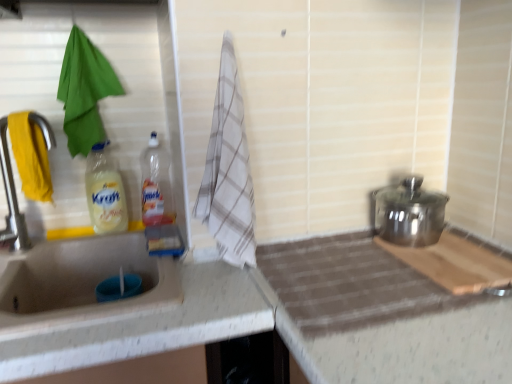
Question: Should I look upward or downward to see translucent plastic bottle at center, placed as the second bottle when sorted from left to right?

Choices:
 (A) up
 (B) down

Answer: (A)

Question: Are translucent plastic bottle at center, placed as the second bottle when sorted from left to right, and polished stainless steel pot at right beside each other?

Choices:
 (A) yes
 (B) no

Answer: (B)

Question: Does translucent plastic bottle at center, positioned as the 1th bottle in right-to-left order, turn towards polished stainless steel pot at right?

Choices:
 (A) no
 (B) yes

Answer: (A)

Question: Does translucent plastic bottle at center, positioned as the 1th bottle in right-to-left order, have a lesser width compared to polished stainless steel pot at right?

Choices:
 (A) yes
 (B) no

Answer: (A)

Question: Considering the relative sizes of translucent plastic bottle at center, positioned as the 1th bottle in right-to-left order, and polished stainless steel pot at right in the image provided, is translucent plastic bottle at center, positioned as the 1th bottle in right-to-left order, wider than polished stainless steel pot at right?

Choices:
 (A) yes
 (B) no

Answer: (B)

Question: Is translucent plastic bottle at center, positioned as the 1th bottle in right-to-left order, further to camera compared to polished stainless steel pot at right?

Choices:
 (A) yes
 (B) no

Answer: (A)

Question: Is the position of translucent plastic bottle at center, placed as the second bottle when sorted from left to right, less distant than that of polished stainless steel pot at right?

Choices:
 (A) yes
 (B) no

Answer: (B)

Question: From a real-world perspective, is translucent plastic bottle at center, positioned as the 1th bottle in right-to-left order, physically below white checkered towel at center, the 1th beach towel in the front-to-back sequence?

Choices:
 (A) no
 (B) yes

Answer: (B)

Question: Is translucent plastic bottle at center, positioned as the 1th bottle in right-to-left order, facing towards white checkered towel at center, the 2th beach towel from the back?

Choices:
 (A) yes
 (B) no

Answer: (B)

Question: Is the surface of translucent plastic bottle at center, placed as the second bottle when sorted from left to right, in direct contact with white checkered towel at center, the 2th beach towel from the back?

Choices:
 (A) no
 (B) yes

Answer: (A)

Question: Is translucent plastic bottle at center, positioned as the 1th bottle in right-to-left order, positioned far away from white checkered towel at center, which appears as the 2th beach towel when viewed from the left?

Choices:
 (A) no
 (B) yes

Answer: (A)

Question: Does translucent plastic bottle at center, placed as the second bottle when sorted from left to right, have a lesser height compared to white checkered towel at center, which appears as the 2th beach towel when viewed from the left?

Choices:
 (A) no
 (B) yes

Answer: (B)

Question: From a real-world perspective, is translucent plastic bottle at center, positioned as the 1th bottle in right-to-left order, over white checkered towel at center, the 1th beach towel in the front-to-back sequence?

Choices:
 (A) yes
 (B) no

Answer: (B)

Question: Considering the relative sizes of matte silver tap at left and green fabric towel at left, the 1th beach towel in the back-to-front sequence, in the image provided, is matte silver tap at left bigger than green fabric towel at left, the 1th beach towel in the back-to-front sequence,?

Choices:
 (A) yes
 (B) no

Answer: (B)